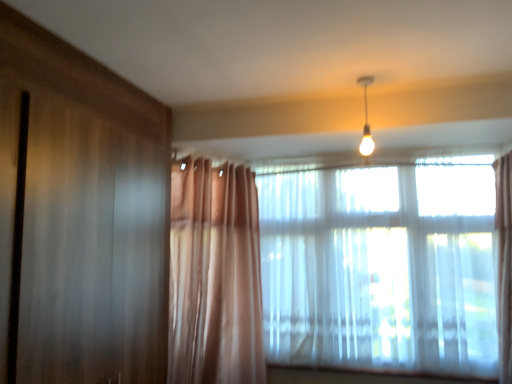
Question: From the image's perspective, is translucent fabric window at center, the 1th window when ordered from left to right, above or below translucent fabric window at upper right, acting as the second window starting from the left?

Choices:
 (A) above
 (B) below

Answer: (B)

Question: Considering the positions of translucent fabric window at center, the 1th window when ordered from left to right, and translucent fabric window at upper right, acting as the second window starting from the left, in the image, is translucent fabric window at center, the 1th window when ordered from left to right, taller or shorter than translucent fabric window at upper right, acting as the second window starting from the left,?

Choices:
 (A) short
 (B) tall

Answer: (A)

Question: Estimate the real-world distances between objects in this image. Which object is farther from the translucent fabric window at center, the 1th window when ordered from left to right?

Choices:
 (A) translucent fabric window at upper right, acting as the second window starting from the left
 (B) matte white bulb at upper center

Answer: (B)

Question: Which of these objects is positioned farthest from the matte white bulb at upper center?

Choices:
 (A) translucent fabric window at center, the 1th window when ordered from left to right
 (B) translucent fabric window at upper right, placed as the first window when sorted from right to left

Answer: (B)